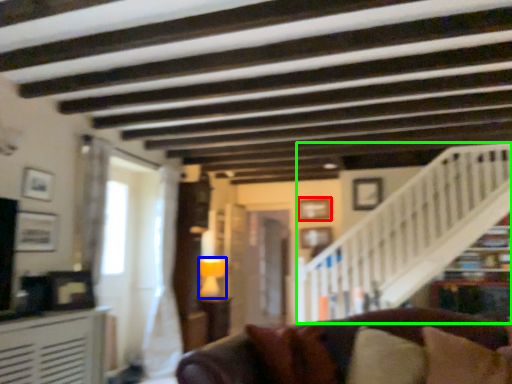
Question: Based on their relative distances, which object is nearer to picture frame (highlighted by a red box)? Choose from lamp (highlighted by a blue box) and stairwell (highlighted by a green box).

Choices:
 (A) lamp
 (B) stairwell

Answer: (B)